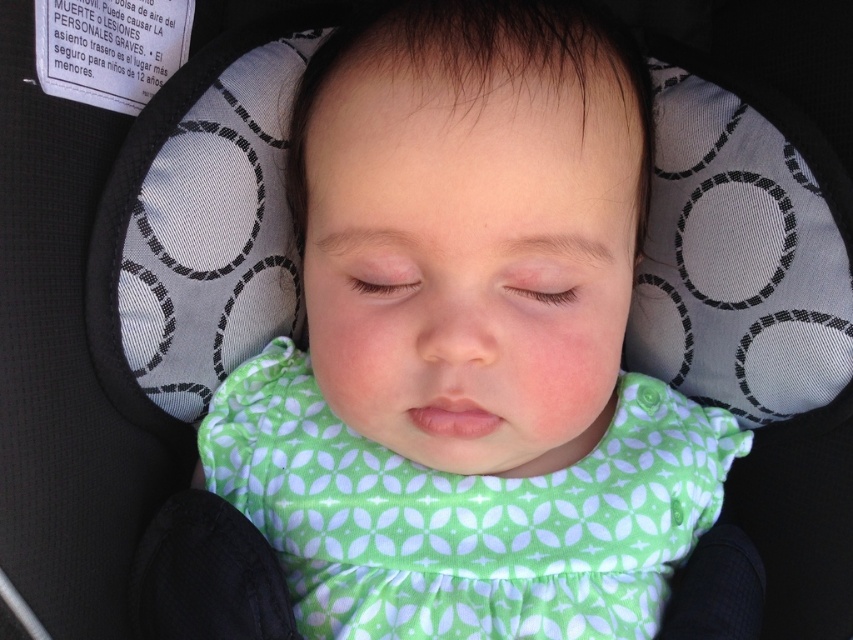
You are a parent checking on your baby in the car seat. You notice the green fabric bib at center and the green fabric dress at center. Which one is closer to you?

The green fabric bib at center is closer to you because it is in front of the green fabric dress at center.